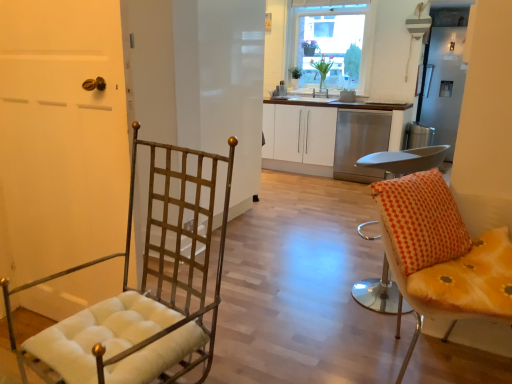
Question: Would you say yellow fabric cushion at right, marked as the 3th chair in a left-to-right arrangement, contains orange fabric cushioned stool at right, marked as the 2th chair in a left-to-right arrangement?

Choices:
 (A) no
 (B) yes

Answer: (A)

Question: From the image's perspective, is yellow fabric cushion at right, marked as the 3th chair in a left-to-right arrangement, located beneath orange fabric cushioned stool at right, marked as the 2th chair in a left-to-right arrangement?

Choices:
 (A) no
 (B) yes

Answer: (B)

Question: Is there a large distance between yellow fabric cushion at right, marked as the 3th chair in a left-to-right arrangement, and orange fabric cushioned stool at right, marked as the 2th chair in a left-to-right arrangement?

Choices:
 (A) yes
 (B) no

Answer: (B)

Question: Can you confirm if yellow fabric cushion at right, marked as the 3th chair in a left-to-right arrangement, is smaller than orange fabric cushioned stool at right, marked as the 2th chair in a left-to-right arrangement?

Choices:
 (A) yes
 (B) no

Answer: (B)

Question: Considering the relative sizes of yellow fabric cushion at right, which is the 1th chair in right-to-left order, and orange fabric cushioned stool at right, marked as the 2th chair in a left-to-right arrangement, in the image provided, is yellow fabric cushion at right, which is the 1th chair in right-to-left order, thinner than orange fabric cushioned stool at right, marked as the 2th chair in a left-to-right arrangement,?

Choices:
 (A) yes
 (B) no

Answer: (B)

Question: Based on their positions, is green leafy plant at upper center, the first houseplant positioned from the left, located to the left or right of yellow fabric cushion at right, which is the 1th chair in right-to-left order?

Choices:
 (A) left
 (B) right

Answer: (A)

Question: Looking at the image, does green leafy plant at upper center, the first houseplant positioned from the left, seem bigger or smaller compared to yellow fabric cushion at right, which is the 1th chair in right-to-left order?

Choices:
 (A) big
 (B) small

Answer: (B)

Question: From the image's perspective, is green leafy plant at upper center, the first houseplant positioned from the left, located above or below yellow fabric cushion at right, marked as the 3th chair in a left-to-right arrangement?

Choices:
 (A) below
 (B) above

Answer: (B)

Question: Is green leafy plant at upper center, the 2th houseplant when ordered from right to left, situated inside yellow fabric cushion at right, which is the 1th chair in right-to-left order, or outside?

Choices:
 (A) outside
 (B) inside

Answer: (A)

Question: From the image's perspective, is metallic grid screen door at center, the first screen door viewed from the left, positioned above or below clear glass window at upper center?

Choices:
 (A) above
 (B) below

Answer: (B)

Question: From a real-world perspective, is metallic grid screen door at center, which is counted as the second screen door, starting from the back, positioned above or below clear glass window at upper center?

Choices:
 (A) below
 (B) above

Answer: (A)

Question: In terms of width, does metallic grid screen door at center, which is counted as the second screen door, starting from the back, look wider or thinner when compared to clear glass window at upper center?

Choices:
 (A) wide
 (B) thin

Answer: (A)

Question: Considering their positions, is metallic grid screen door at center, which is counted as the second screen door, starting from the back, located in front of or behind clear glass window at upper center?

Choices:
 (A) behind
 (B) front

Answer: (B)

Question: Choose the correct answer: Is clear glass window at upper center inside metallic grid screen door at center, the 2th screen door in the right-to-left sequence, or outside it?

Choices:
 (A) outside
 (B) inside

Answer: (A)

Question: In terms of size, does clear glass window at upper center appear bigger or smaller than metallic grid screen door at center, the first screen door viewed from the left?

Choices:
 (A) big
 (B) small

Answer: (B)